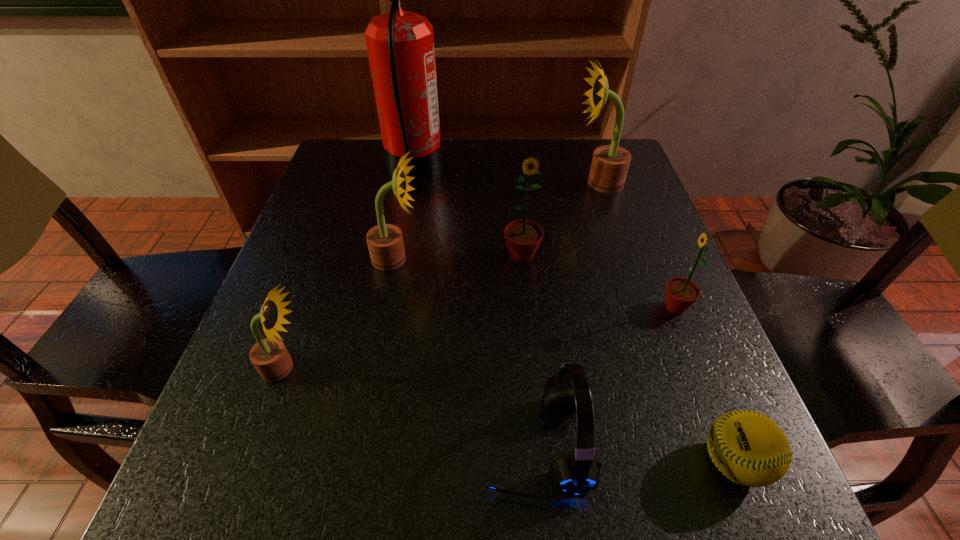
Image resolution: width=960 pixels, height=540 pixels. I want to click on object that is at the near right corner, so pyautogui.click(x=749, y=448).

Where is `vacant space at the far edge`? vacant space at the far edge is located at coordinates (466, 183).

Locate an element on the screen. free space at the near edge of the desktop is located at coordinates (450, 476).

Find the location of a particular element. This screenshot has width=960, height=540. vacant space at the left edge of the desktop is located at coordinates (356, 199).

Where is `free space at the right edge of the desktop`? The width and height of the screenshot is (960, 540). free space at the right edge of the desktop is located at coordinates (640, 397).

Identify the location of vacant region at the far left corner of the desktop. (316, 187).

This screenshot has height=540, width=960. Identify the location of vacant space at the near left corner. (194, 485).

This screenshot has width=960, height=540. What are the coordinates of `free spot between the right green sunflower and the fourth sunflower from right to left` in the screenshot? It's located at (536, 283).

Identify the location of free area in between the black fire extinguisher and the bigger green sunflower. Image resolution: width=960 pixels, height=540 pixels. (468, 213).

This screenshot has width=960, height=540. Identify the location of vacant area that lies between the softball and the left green sunflower. (628, 359).